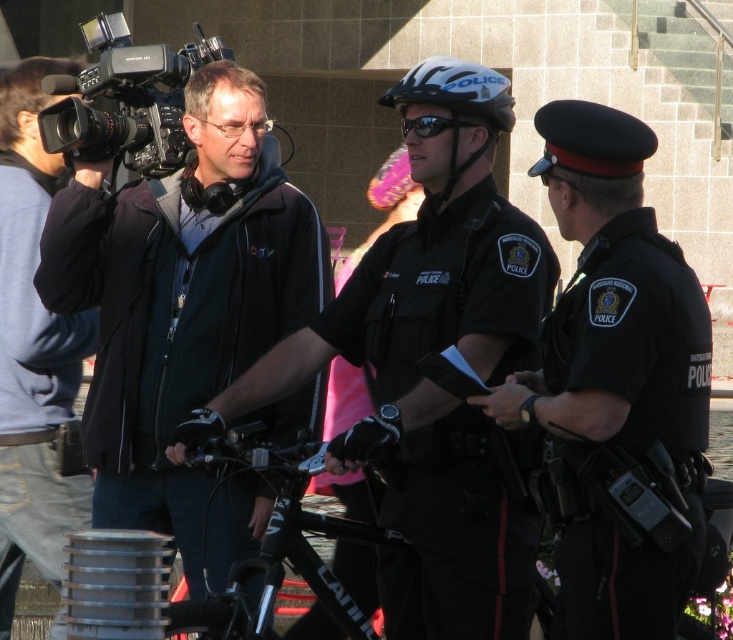
You are a passerby who just noticed the matte black jacket at center and the black plastic video camera at upper left in the scene. Which object is taller?

The black plastic video camera at upper left is taller than the matte black jacket at center.

You are a pedestrian in the scene. You need to know which object is taller between the dark blue uniform at center and the black plastic video camera at upper left. Can you tell me?

The dark blue uniform at center is much taller than the black plastic video camera at upper left.

In the urban scene described, there are two individuals wearing jackets. One is wearing a black matte jacket at left and the other a matte black jacket at center. Which jacket is positioned to the right of the other?

The black matte jacket at left is positioned on the right side of the matte black jacket at center, meaning the black matte jacket at left is to the right of the matte black jacket at center.